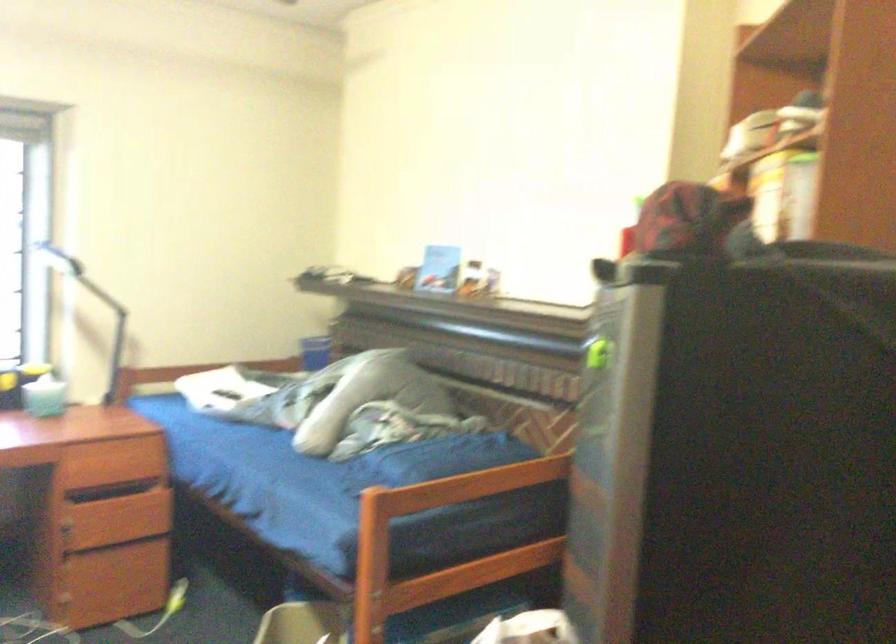
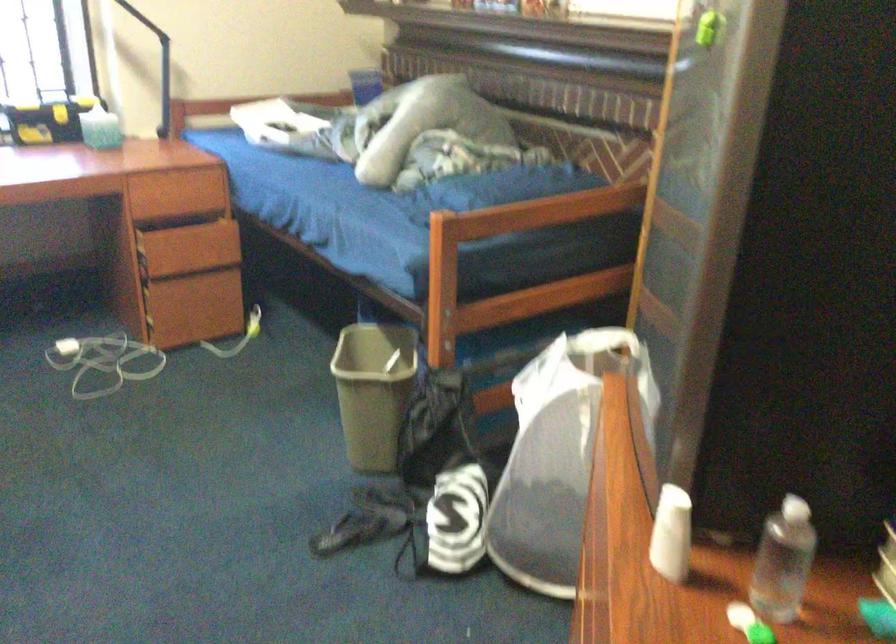
Question: The images are taken continuously from a first-person perspective. In which direction is your viewpoint rotating?

Choices:
 (A) Left
 (B) Right
 (C) Up
 (D) Down

Answer: (D)